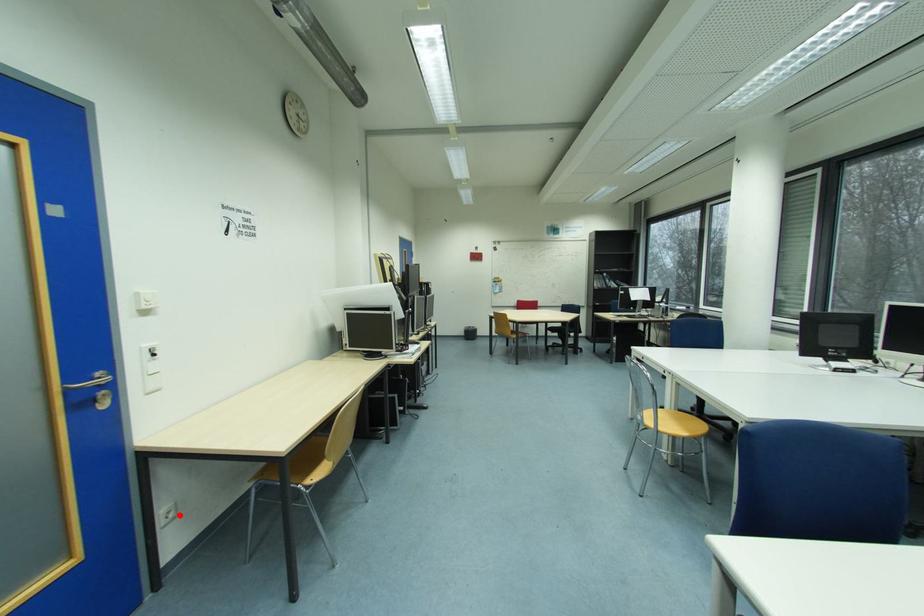
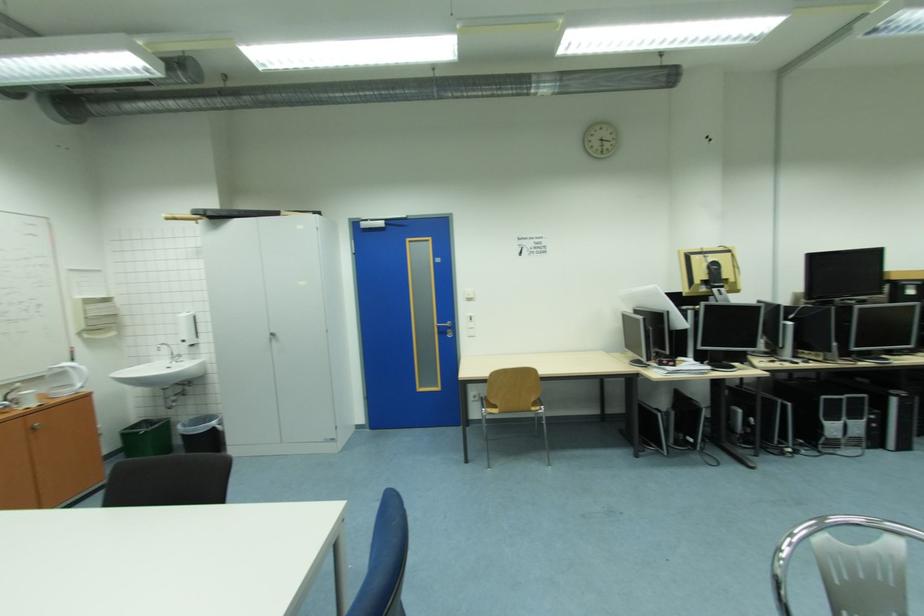
In the second image, find the point that corresponds to the highlighted location in the first image.

(483, 400)